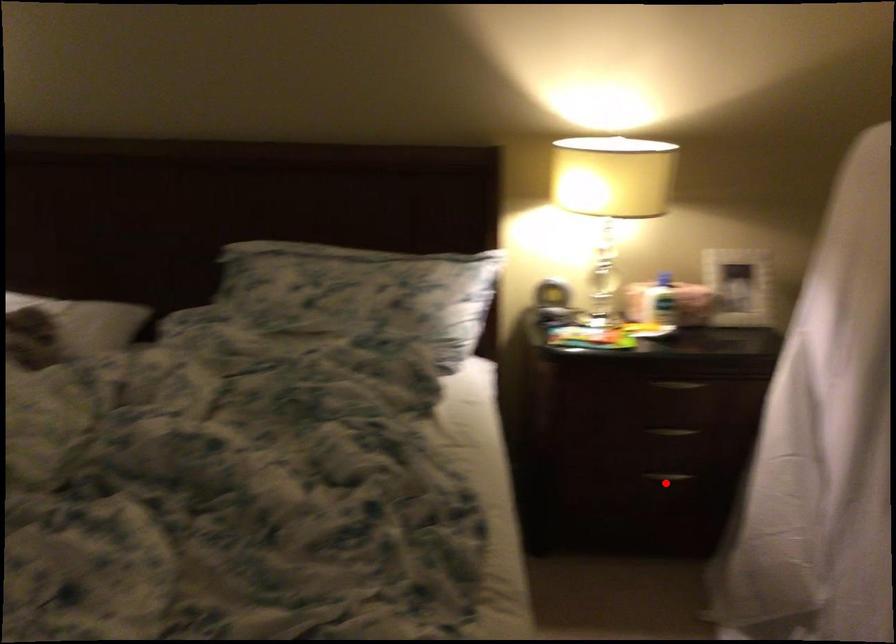
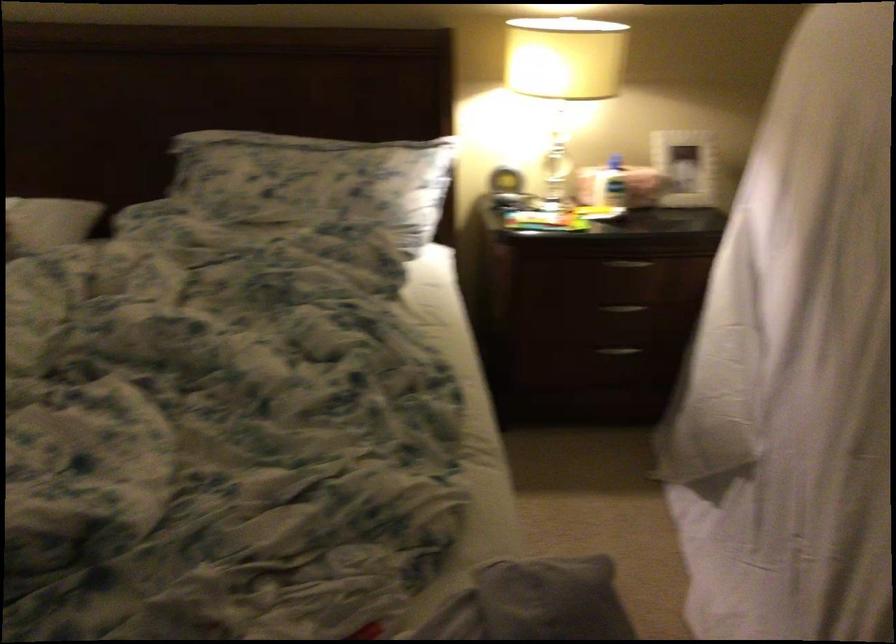
Find the pixel in the second image that matches the highlighted location in the first image.

(616, 355)